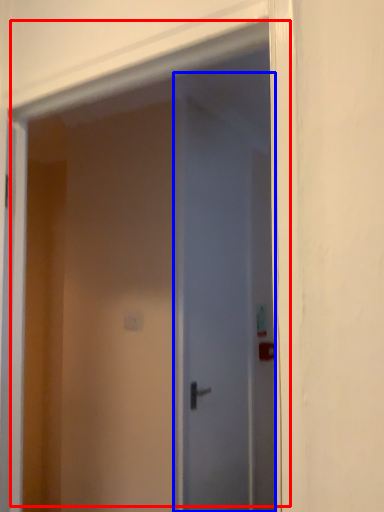
Question: Among these objects, which one is nearest to the camera, door (highlighted by a red box) or door (highlighted by a blue box)?

Choices:
 (A) door
 (B) door

Answer: (A)